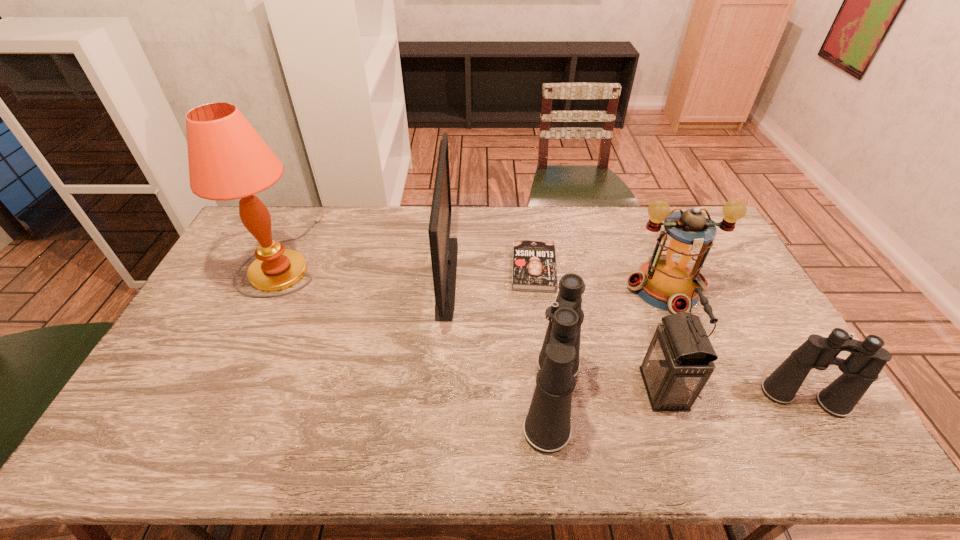
This screenshot has width=960, height=540. In the image, there is a desktop. Find the location of `vacant space at the far left corner`. vacant space at the far left corner is located at coordinates (276, 233).

Find the location of a particular element. This screenshot has width=960, height=540. free point between the book and the farther lantern is located at coordinates (599, 278).

You are a GUI agent. You are given a task and a screenshot of the screen. Output one action in this format:
    pyautogui.click(x=<x>, y=<y>)
    Task: Click on the vacant point located between the left binoculars and the leftmost object
    Image resolution: width=960 pixels, height=540 pixels.
    Given the screenshot: What is the action you would take?
    pyautogui.click(x=420, y=326)

Identify the location of empty location between the shorter binoculars and the farther lantern. Image resolution: width=960 pixels, height=540 pixels. (734, 343).

This screenshot has height=540, width=960. In order to click on vacant space that's between the lamp and the farther lantern in this screenshot , I will do `click(475, 272)`.

Where is `free point between the nearer lantern and the tallest object`? This screenshot has width=960, height=540. free point between the nearer lantern and the tallest object is located at coordinates (474, 322).

This screenshot has height=540, width=960. Find the location of `unoccupied area between the left binoculars and the book`. unoccupied area between the left binoculars and the book is located at coordinates (543, 333).

Locate which object ranks fifth in proximity to the shortest object. Please provide its 2D coordinates. Your answer should be formatted as a tuple, i.e. [(x, y)], where the tuple contains the x and y coordinates of a point satisfying the conditions above.

[(861, 368)]

Identify which object is located as the second nearest to the taller binoculars. Please provide its 2D coordinates. Your answer should be formatted as a tuple, i.e. [(x, y)], where the tuple contains the x and y coordinates of a point satisfying the conditions above.

[(444, 250)]

The width and height of the screenshot is (960, 540). Identify the location of vacant region that satisfies the following two spatial constraints: 1. on the front-facing side of the shorter binoculars; 2. on the right side of the nearer lantern. (666, 398).